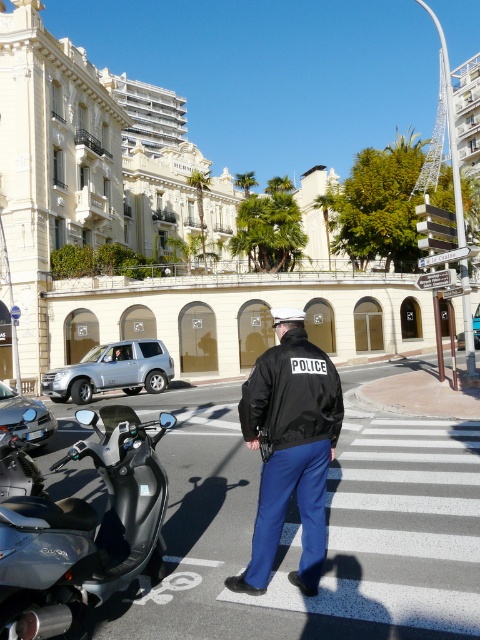
Describe the element at coordinates (84, 531) in the screenshot. I see `black matte scooter at lower left` at that location.

Which is in front, point (111, 508) or point (264, 525)?

Point (264, 525)

Find the location of `black matte scooter at lower left`. black matte scooter at lower left is located at coordinates (84, 531).